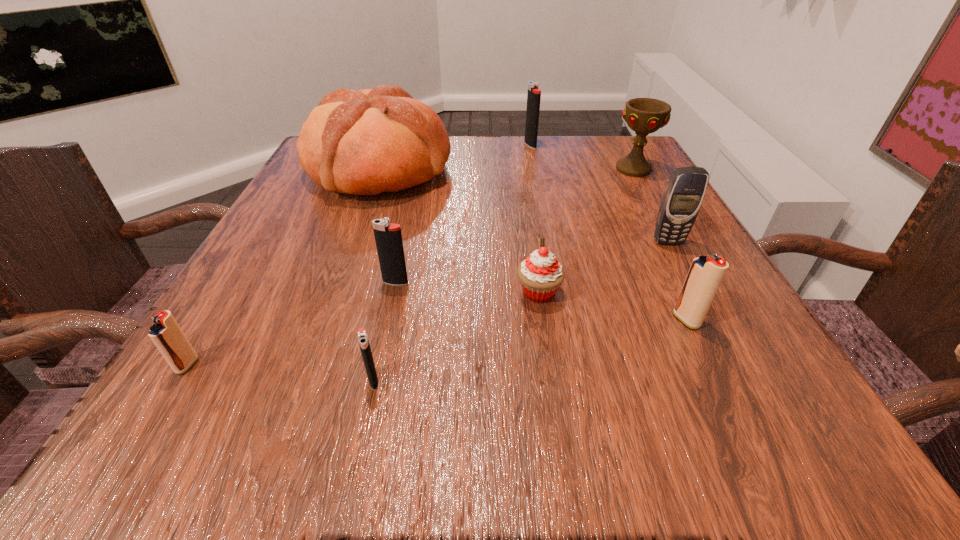
You are a GUI agent. You are given a task and a screenshot of the screen. Output one action in this format:
    pyautogui.click(x=<x>, y=<y>)
    Task: Click on the igniter situated at the right edge
    Image resolution: width=960 pixels, height=540 pixels.
    Given the screenshot: What is the action you would take?
    pyautogui.click(x=706, y=273)

Image resolution: width=960 pixels, height=540 pixels. In order to click on object at the far left corner in this screenshot , I will do `click(366, 142)`.

Identify the location of object present at the far right corner. (644, 116).

In the image, there is a desktop. Identify the location of free space at the far edge. Image resolution: width=960 pixels, height=540 pixels. (519, 146).

Find the location of `vacant space at the near edge of the desktop`. vacant space at the near edge of the desktop is located at coordinates pos(311,440).

The image size is (960, 540). What are the coordinates of `blank space at the left edge of the desktop` in the screenshot? It's located at (324, 282).

Locate an element on the screen. This screenshot has width=960, height=540. free space at the near left corner of the desktop is located at coordinates (241, 418).

Where is `free location at the near right corner of the desktop`? This screenshot has height=540, width=960. free location at the near right corner of the desktop is located at coordinates (673, 394).

Identify the location of free spot between the cupcake and the red chalice. (586, 231).

Where is `free space between the cupcake and the farthest igniter`? The image size is (960, 540). free space between the cupcake and the farthest igniter is located at coordinates (535, 219).